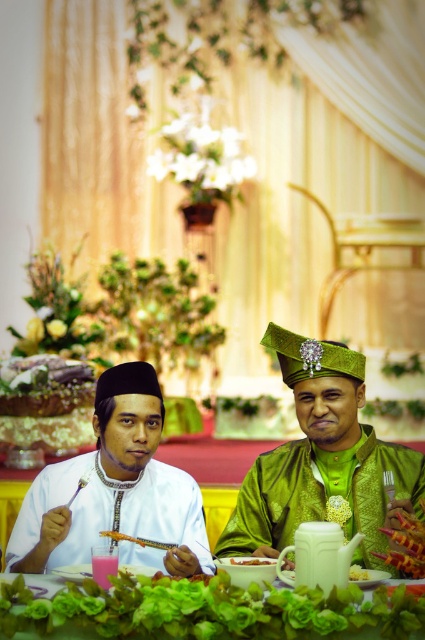
Question: Is white matte shirt at center positioned at the back of smooth white bowl at center?

Choices:
 (A) yes
 (B) no

Answer: (A)

Question: Which object is positioned farthest from the green satin turban at center?

Choices:
 (A) white satin shirt at left
 (B) orange textured food at center
 (C) white glossy rice at center

Answer: (C)

Question: Estimate the real-world distances between objects in this image. Which object is closer to the smooth white bowl at center?

Choices:
 (A) white satin shirt at left
 (B) green fabric table at center
 (C) white matte shirt at center
 (D) orange textured food at center

Answer: (D)

Question: Which point appears farthest from the camera in this image?

Choices:
 (A) (237, 557)
 (B) (354, 564)

Answer: (A)

Question: Is smooth white bowl at center further to the viewer compared to white glossy rice at center?

Choices:
 (A) yes
 (B) no

Answer: (B)

Question: Where is green fabric table at center located in relation to white glossy rice at center in the image?

Choices:
 (A) left
 (B) right

Answer: (A)